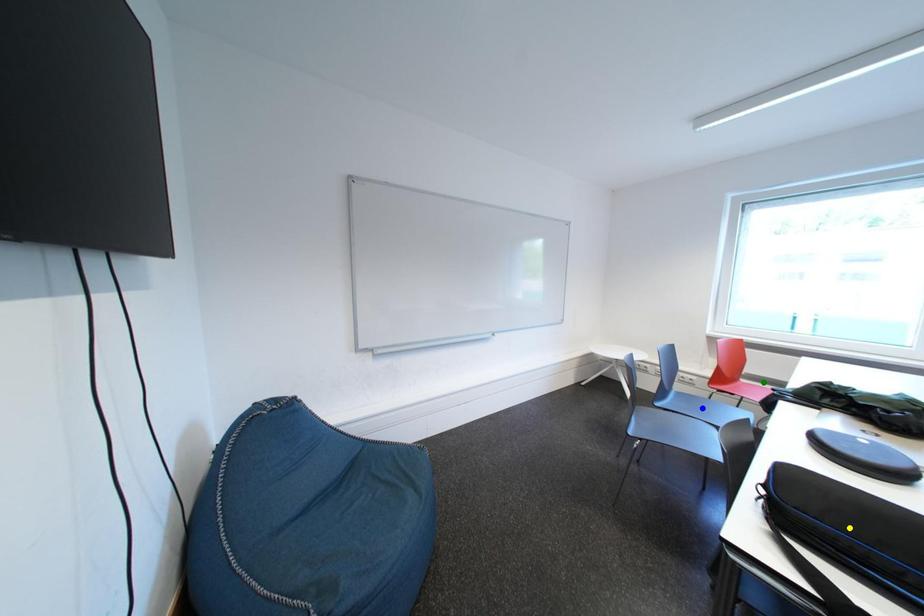
Order these from nearest to farthest:
1. yellow point
2. blue point
3. green point

yellow point, green point, blue point